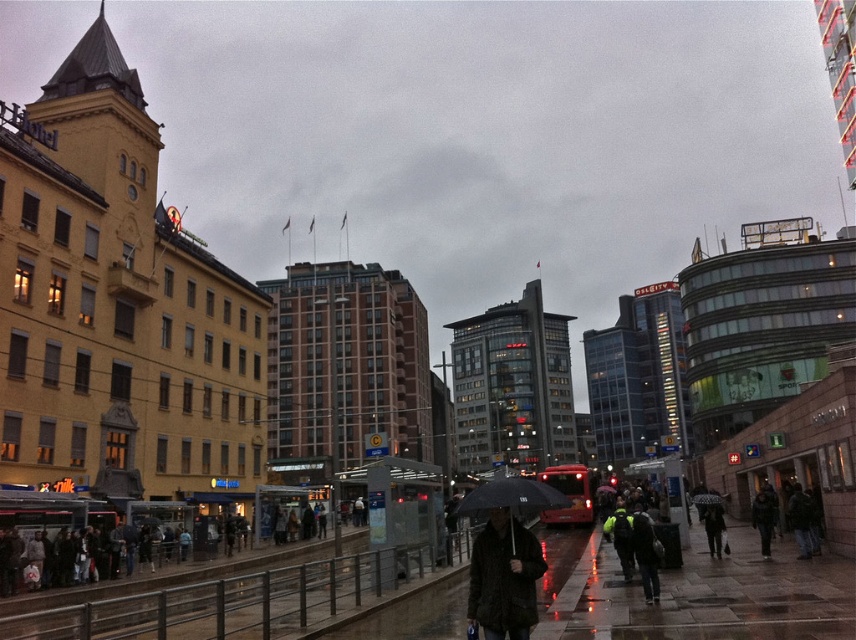
You are standing at the point marked as point (107, 541) in the image. What is the nearest object to you in the scene?

The nearest object to you is the dark gray fabric crowd at lower left, as the point (107, 541) is located on it.

You are a fashion designer observing two jackets in the middle of an urban scene. Which jacket is positioned to the left when looking at the dark brown leather jacket at center and the dark matte jacket at center?

The dark brown leather jacket at center is positioned to the left of the dark matte jacket at center.